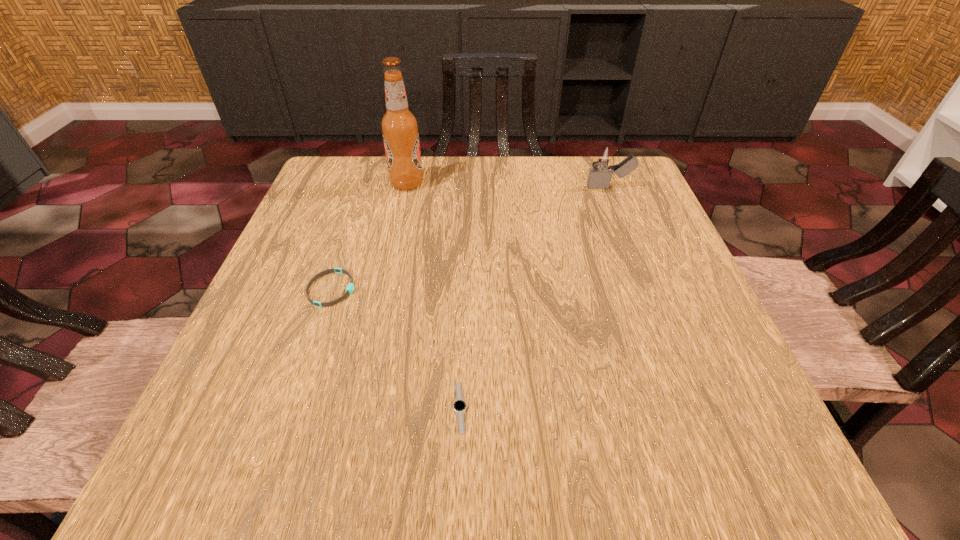
You are a GUI agent. You are given a task and a screenshot of the screen. Output one action in this format:
    pyautogui.click(x=<x>, y=<y>)
    Task: Click on the third object from right to left
    
    Given the screenshot: What is the action you would take?
    399,126

Find the location of `beer bottle`. beer bottle is located at coordinates (399, 126).

Locate an element on the screen. The width and height of the screenshot is (960, 540). igniter is located at coordinates (599, 177).

Locate an element on the screen. The height and width of the screenshot is (540, 960). the third shortest object is located at coordinates (599, 177).

Locate an element on the screen. This screenshot has height=540, width=960. the leftmost object is located at coordinates (350, 287).

Image resolution: width=960 pixels, height=540 pixels. Identify the location of wristband. (350, 287).

This screenshot has height=540, width=960. What are the coordinates of `the shortest object` in the screenshot? It's located at (459, 406).

Locate an element on the screen. The height and width of the screenshot is (540, 960). watch is located at coordinates (459, 406).

The height and width of the screenshot is (540, 960). Find the location of `free region located 0.200m on the front label of the beer bottle`. free region located 0.200m on the front label of the beer bottle is located at coordinates (505, 184).

Locate an element on the screen. vacant space located on the front of the igniter is located at coordinates (618, 211).